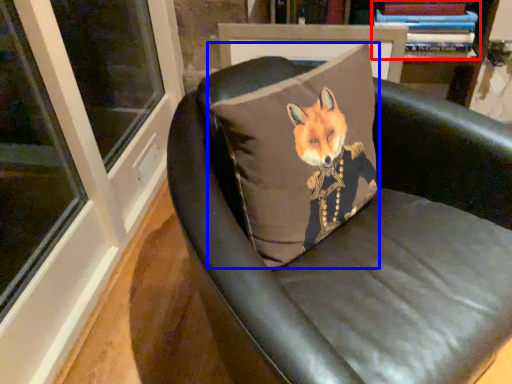
Question: Which point is further to the camera, book (highlighted by a red box) or pillow (highlighted by a blue box)?

Choices:
 (A) book
 (B) pillow

Answer: (A)